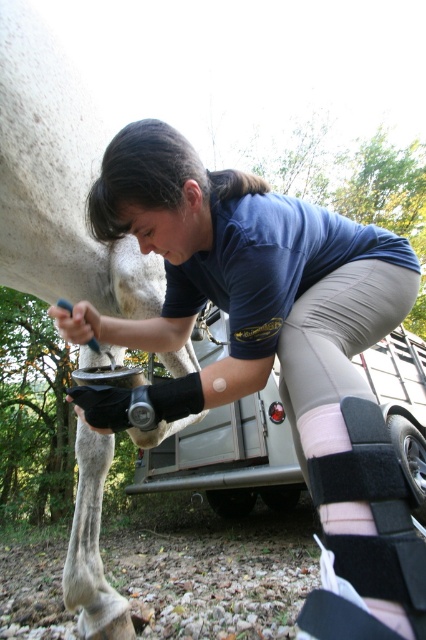
Question: Based on their relative distances, which object is nearer to the black/pink fabric knee pad at lower center?

Choices:
 (A) black matte knee brace at lower center
 (B) white matte horse leg at upper left

Answer: (A)

Question: Does white matte horse leg at upper left appear over black/pink fabric knee pad at lower center?

Choices:
 (A) yes
 (B) no

Answer: (A)

Question: Is black matte knee brace at lower center above black/pink fabric knee pad at lower center?

Choices:
 (A) no
 (B) yes

Answer: (B)

Question: Does black matte knee brace at lower center have a smaller size compared to white matte horse leg at upper left?

Choices:
 (A) no
 (B) yes

Answer: (A)

Question: Which object is positioned farthest from the black/pink fabric knee pad at lower center?

Choices:
 (A) black matte knee brace at lower center
 (B) white matte horse leg at upper left

Answer: (B)

Question: Estimate the real-world distances between objects in this image. Which object is farther from the black/pink fabric knee pad at lower center?

Choices:
 (A) black matte knee brace at lower center
 (B) white matte horse leg at upper left

Answer: (B)